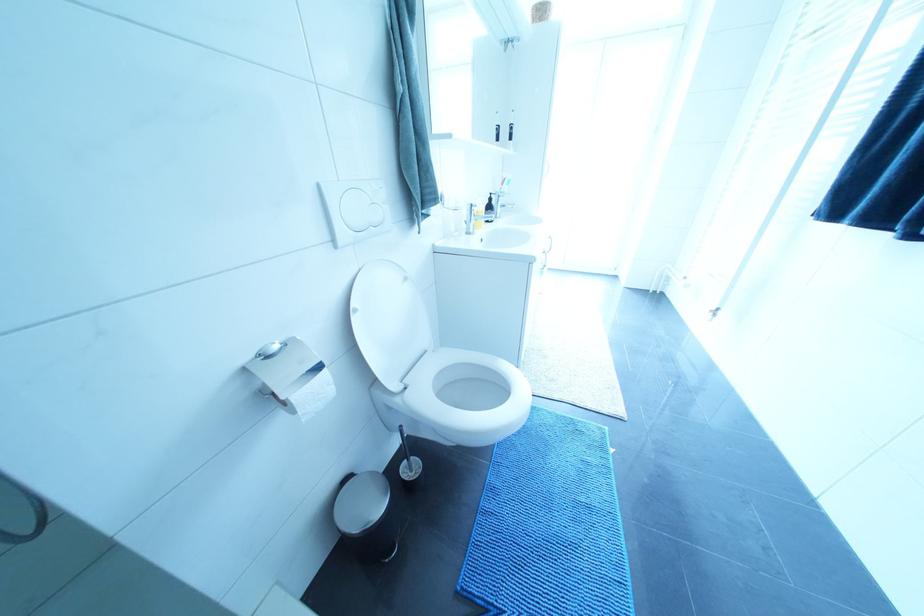
You are a GUI agent. You are given a task and a screenshot of the screen. Output one action in this format:
    pyautogui.click(x=<x>, y=<y>)
    Task: Click on the black soap pump
    The image size is (924, 616).
    Given the screenshot: What is the action you would take?
    pyautogui.click(x=489, y=207)